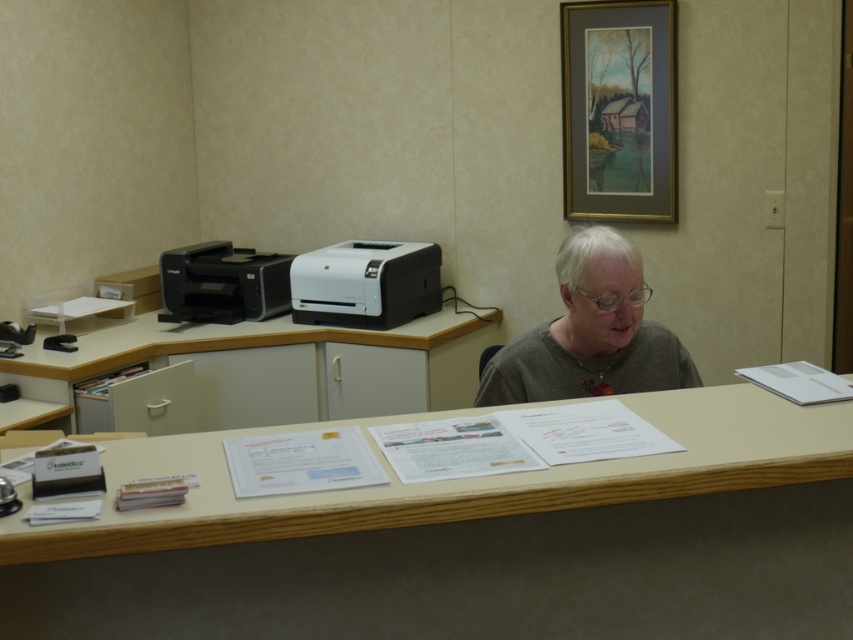
You are standing at the entrance of the office and want to hand a document to the person wearing the gray matte shirt at center. The office has a clearance height of 7 feet. Can you safely reach them without hitting your head?

The distance between you and the gray matte shirt at center is 6.89 feet. Since the office has a clearance height of 7 feet, you can safely reach them without hitting your head as the required height is slightly higher than the distance.

You are standing in the office and want to reach both the point at coordinates (x=608, y=268) and the point at coordinates (x=256, y=310). Which point will you reach first if you move straight towards them?

You will reach point (x=608, y=268) first because it is closer to you than point (x=256, y=310).

You are a delivery person entering the office and need to place a package on the wooden table at lower center. However, the white plastic printer at center is blocking the way. Can you walk around the printer to reach the table?

The wooden table at lower center is in front of the white plastic printer at center, so you would need to move around the printer to access the table. Since the table is positioned in front of the printer, you can likely navigate around the printer to reach the table.